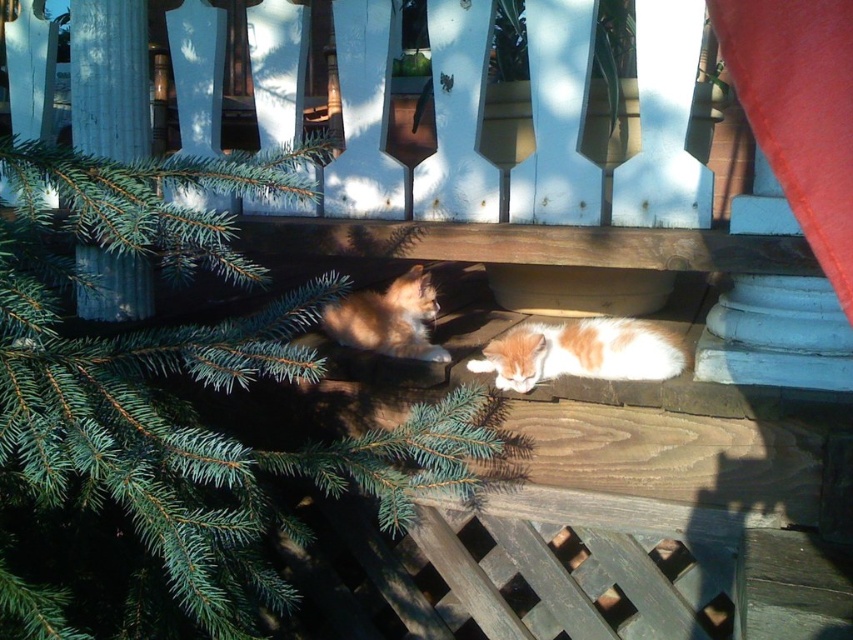
Between orange-white fur cat at center and orange fur cat at left, which one appears on the right side from the viewer's perspective?

orange-white fur cat at center

Does orange-white fur cat at center have a smaller size compared to orange fur cat at left?

No.

This screenshot has width=853, height=640. Describe the element at coordinates (582, 353) in the screenshot. I see `orange-white fur cat at center` at that location.

Identify the location of orange-white fur cat at center. point(582,353).

Does green needle-like tree at lower left come in front of orange-white fur cat at center?

That is True.

At what (x,y) coordinates should I click in order to perform the action: click on green needle-like tree at lower left. Please return your answer as a coordinate pair (x, y). Looking at the image, I should click on (x=164, y=413).

Who is higher up, green needle-like tree at lower left or orange fur cat at left?

orange fur cat at left is above.

Does green needle-like tree at lower left appear on the left side of orange fur cat at left?

Correct, you'll find green needle-like tree at lower left to the left of orange fur cat at left.

Image resolution: width=853 pixels, height=640 pixels. What do you see at coordinates (164, 413) in the screenshot?
I see `green needle-like tree at lower left` at bounding box center [164, 413].

The image size is (853, 640). Identify the location of green needle-like tree at lower left. (164, 413).